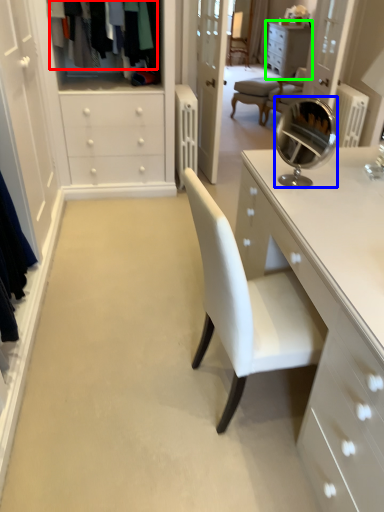
Question: Which object is the farthest from clothing (highlighted by a red box)? Choose among these: mirror (highlighted by a blue box) or cabinetry (highlighted by a green box).

Choices:
 (A) mirror
 (B) cabinetry

Answer: (B)